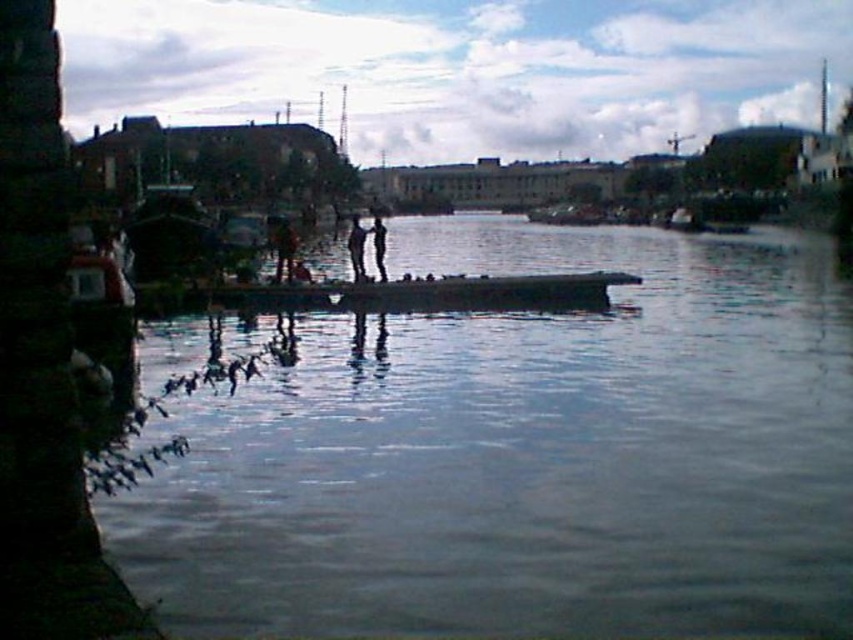
Question: Does smooth concrete dock at center have a larger size compared to black matte person at center?

Choices:
 (A) no
 (B) yes

Answer: (B)

Question: Is smooth concrete dock at center positioned in front of black matte person at center?

Choices:
 (A) yes
 (B) no

Answer: (A)

Question: Which point is farther from the camera taking this photo?

Choices:
 (A) (373, 220)
 (B) (357, 227)

Answer: (B)

Question: Estimate the real-world distances between objects in this image. Which object is closer to the black matte person at center?

Choices:
 (A) smooth black figure at center
 (B) smooth concrete dock at center

Answer: (A)

Question: Is smooth black figure at center thinner than black matte person at center?

Choices:
 (A) no
 (B) yes

Answer: (A)

Question: Among these points, which one is nearest to the camera?

Choices:
 (A) (181, 604)
 (B) (372, 225)
 (C) (363, 259)

Answer: (A)